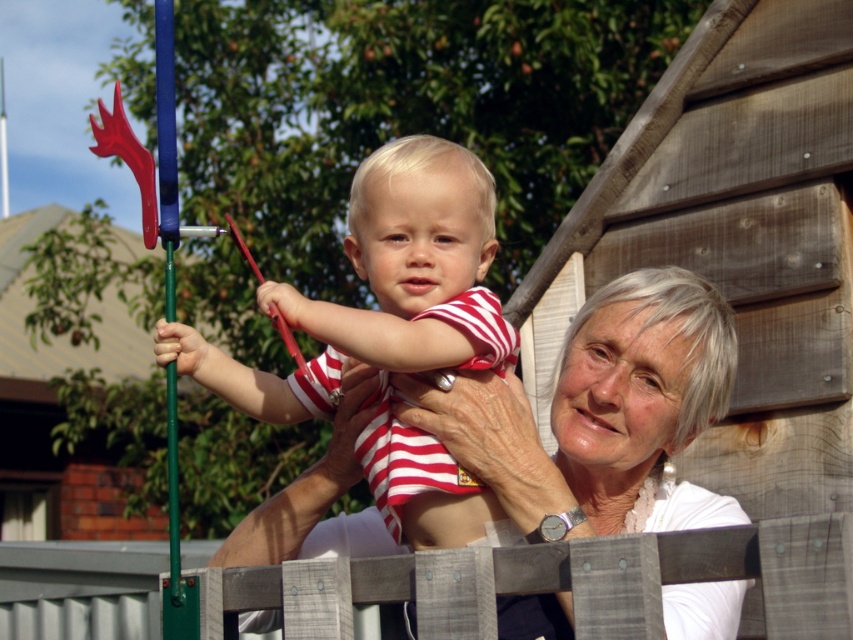
Can you confirm if white matte/soft skin at center is positioned to the right of striped cotton shirt at center?

Yes, white matte/soft skin at center is to the right of striped cotton shirt at center.

Between point (306, 502) and point (463, 166), which one is positioned behind?

Point (306, 502)

Identify the location of white matte/soft skin at center. The height and width of the screenshot is (640, 853). tap(614, 410).

Is striped cotton shirt at center wider than wooden fence at center?

Yes.

Which of these two, striped cotton shirt at center or wooden fence at center, stands taller?

Standing taller between the two is striped cotton shirt at center.

Does point (468, 513) lie behind point (822, 579)?

Yes, it is behind point (822, 579).

Where is `striped cotton shirt at center`? The image size is (853, 640). striped cotton shirt at center is located at coordinates (412, 266).

Based on the photo, who is higher up, white matte/soft skin at center or wooden fence at center?

white matte/soft skin at center

Describe the element at coordinates (614, 410) in the screenshot. I see `white matte/soft skin at center` at that location.

The height and width of the screenshot is (640, 853). Find the location of `white matte/soft skin at center`. white matte/soft skin at center is located at coordinates (614, 410).